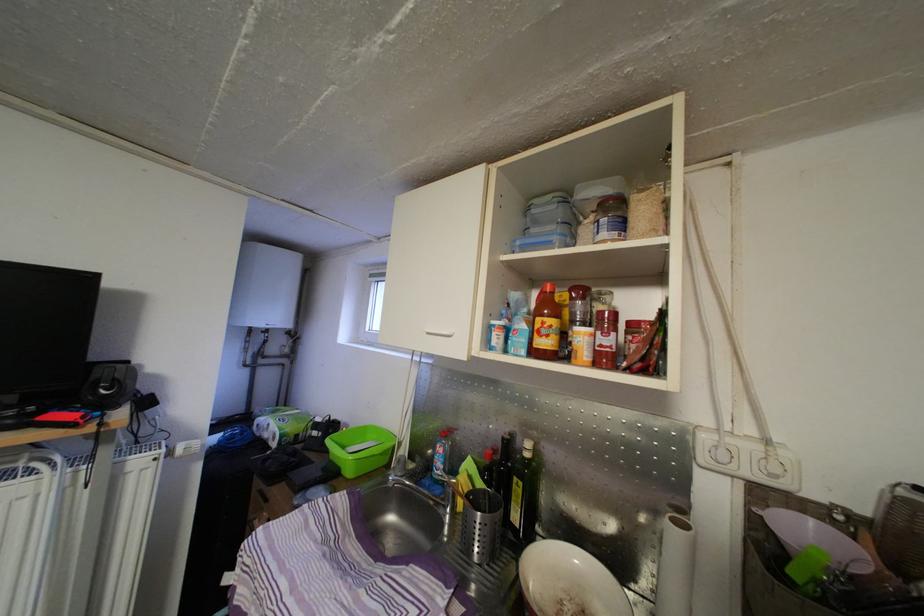
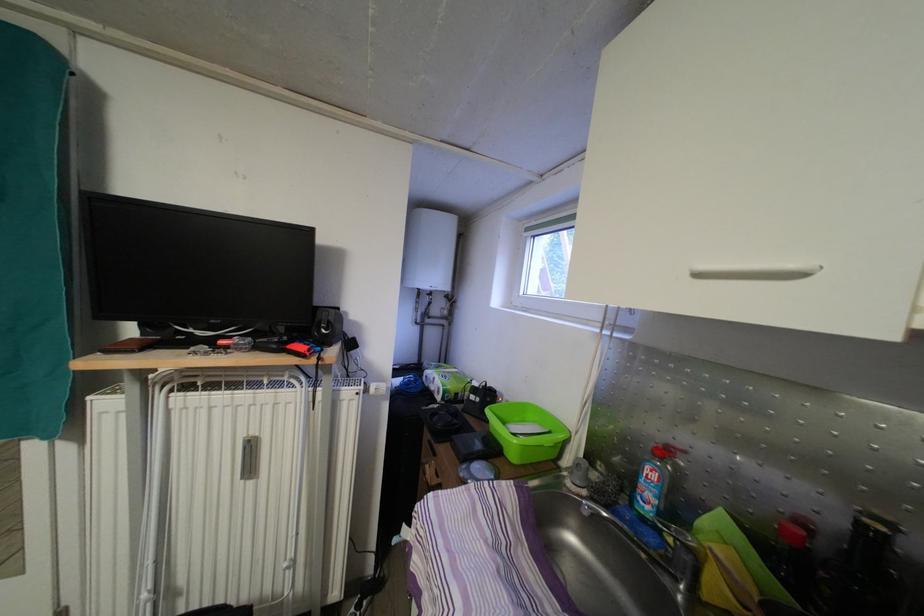
In the second image, find the point that corresponds to point 337,438 in the first image.

(495, 406)